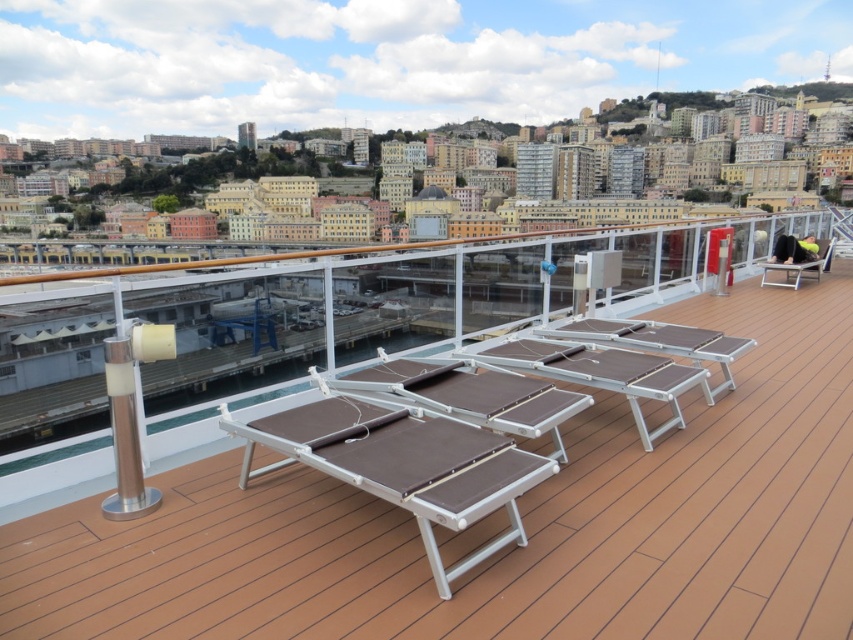
You are planning to place a new small table between the brown wood deck at center and the brown fabric chair at right. Which object should the table be closer to if it needs to be near the larger one?

The table should be closer to the brown wood deck at center because it is larger than the brown fabric chair at right according to the description.

You are standing on the deck and want to place a new potted plant between the brown wood deck at center and the brown fabric chair at right. Based on their positions, which object should the plant be closer to?

The brown wood deck at center is positioned under the brown fabric chair at right, so the plant should be placed closer to the brown wood deck at center to maintain the spatial relationship between the two objects.